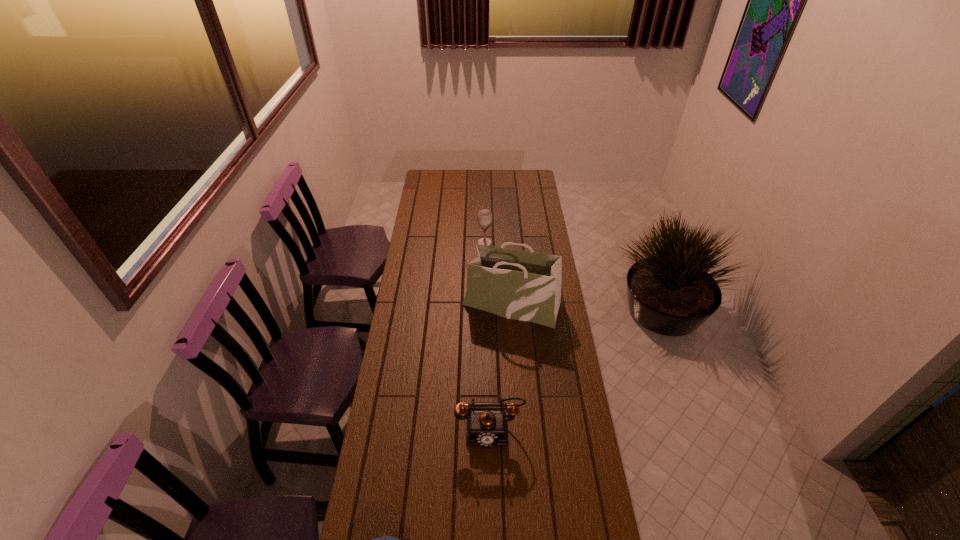
Locate an element on the screen. The width and height of the screenshot is (960, 540). the second farthest object is located at coordinates (521, 285).

Locate an element on the screen. grocery bag is located at coordinates point(521,285).

The height and width of the screenshot is (540, 960). I want to click on the farthest object, so click(x=484, y=216).

Find the location of a particular element. the third farthest object is located at coordinates (487, 426).

Where is `vacant space located on the back of the grocery bag`? vacant space located on the back of the grocery bag is located at coordinates (508, 253).

In order to click on free space located 0.290m on the front of the farthest object in this screenshot , I will do `click(485, 288)`.

Locate an element on the screen. vacant point located 0.090m on the front of the second nearest object at the rotary dial is located at coordinates (491, 476).

Identify the location of object that is at the right edge. (521, 285).

Locate an element on the screen. This screenshot has height=540, width=960. blank space at the far edge of the desktop is located at coordinates (448, 176).

In the image, there is a desktop. Identify the location of blank space at the left edge. (407, 360).